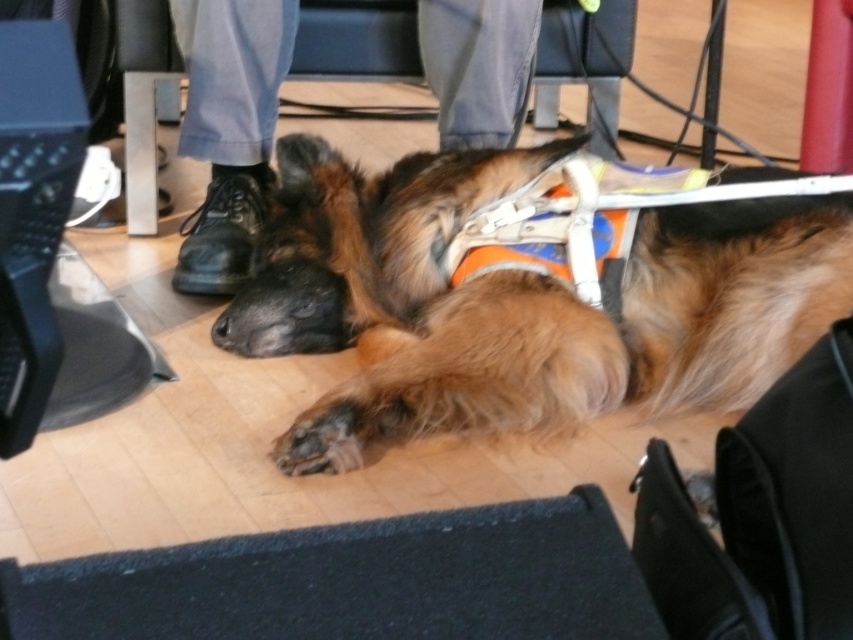
Consider the image. You are standing in front of the German Shepherd dog and want to place a small treat between the two points labeled point (x=372, y=252) and point (x=245, y=72). Which point should you aim for to ensure the treat is closer to the dog?

You should aim for point (x=372, y=252) because it is closer to the camera, meaning it is nearer to where you are standing in front of the dog. The point (x=245, y=72) is farther away from the camera and thus farther from the dog.

You are standing in the room and want to move from point A to point B. If point A is at point (213, 33) and point B is at point (228, 109), which direction should you move to reach point B from point A?

To move from point A at (213, 33) to point B at (228, 109), you should move forward since point B is behind point A according to the coordinates provided.

What object in the scene corresponds to the coordinate point (x=229, y=129)?

The black leather shoes at lower center correspond to the coordinate point (x=229, y=129).